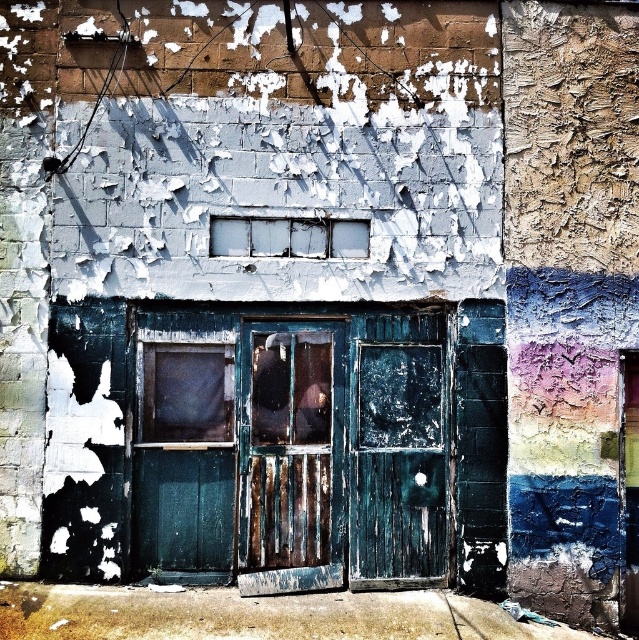
Question: Which object is the farthest from the teal wooden door at center?

Choices:
 (A) white frosted glass window at center
 (B) rusty wood door at center

Answer: (A)

Question: Is teal wooden door at center thinner than white frosted glass window at center?

Choices:
 (A) no
 (B) yes

Answer: (A)

Question: Is rusty wood door at center positioned before white frosted glass window at center?

Choices:
 (A) no
 (B) yes

Answer: (B)

Question: Among these points, which one is nearest to the camera?

Choices:
 (A) (226, 230)
 (B) (327, 440)

Answer: (A)

Question: Estimate the real-world distances between objects in this image. Which object is closer to the teal wooden door at center?

Choices:
 (A) white frosted glass window at center
 (B) rusty wood door at center

Answer: (B)

Question: Does teal wooden door at center have a smaller size compared to white frosted glass window at center?

Choices:
 (A) yes
 (B) no

Answer: (B)